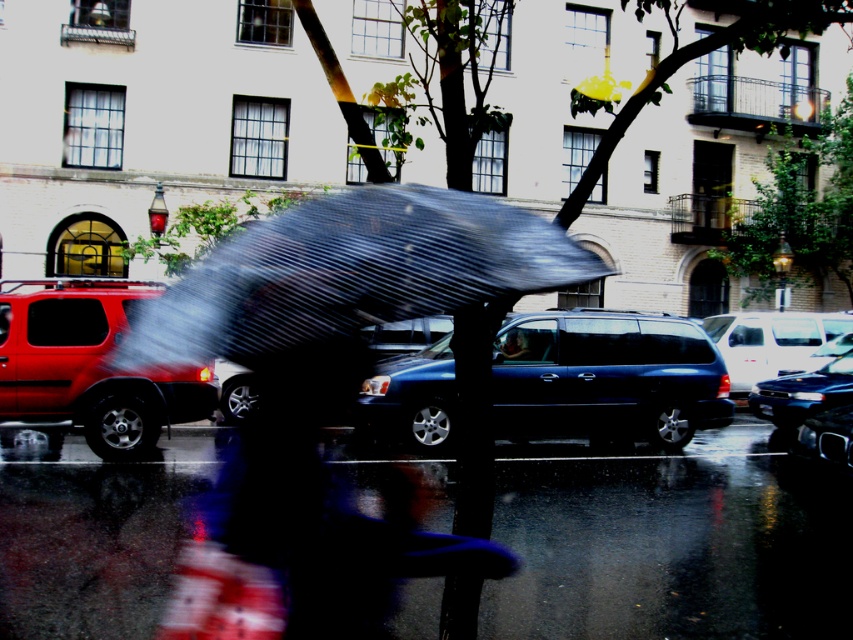
You are standing on the rainy street and want to walk from the point at coordinates point [769,554] to the point at coordinates point [821,388]. Which direction should you move relative to the parked cars?

You should move backward towards the parked cars because point [769,554] is in front of point [821,388].

You are a delivery person trying to navigate a rainy street. You see the glossy asphalt pavement at lower center and the translucent plastic umbrella at center. Which object is larger in the image?

The translucent plastic umbrella at center is larger than the glossy asphalt pavement at lower center.

You are a pedestrian trying to cross the street while holding the translucent plastic umbrella at center. There is a shiny black sedan at center in your path. Can you safely walk under the umbrella to avoid the car?

The translucent plastic umbrella at center is located above shiny black sedan at center, so the umbrella is actually above the car. This means the car is below the umbrella, so you can safely walk under the umbrella to avoid the car.